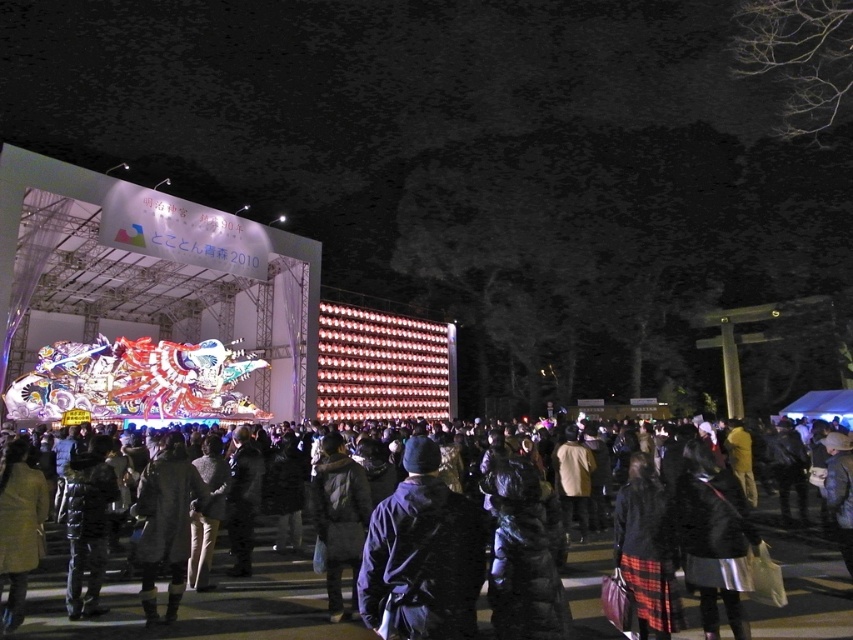
You are standing at the center of the scene and want to move to the dark gray coat at center. Given that you can only walk straight ahead, will you collide with the dark blue jacket at center before reaching your destination?

The dark blue jacket at center is 9.72 meters away from the dark gray coat at center. Since you are starting at the center and moving straight toward the dark gray coat at center, you would first encounter the dark blue jacket at center at 9.72 meters away, so yes, you will collide with the dark blue jacket at center before reaching the dark gray coat at center.

You are a photographer standing in the crowd at the festival. You want to take a photo of both the dark gray coat at center and the dark gray jacket at center. Which one will appear larger in your photo?

The dark gray coat at center will appear larger in the photo because it is closer to the viewer than the dark gray jacket at center.

You are a fashion designer attending the festival and see both the dark gray wool coat at center and the dark blue jacket at center. Which one would you recommend to a client who prefers a more voluminous style?

The dark gray wool coat at center has a larger size compared to the dark blue jacket at center, so it would be the better choice for someone who prefers a more voluminous style.